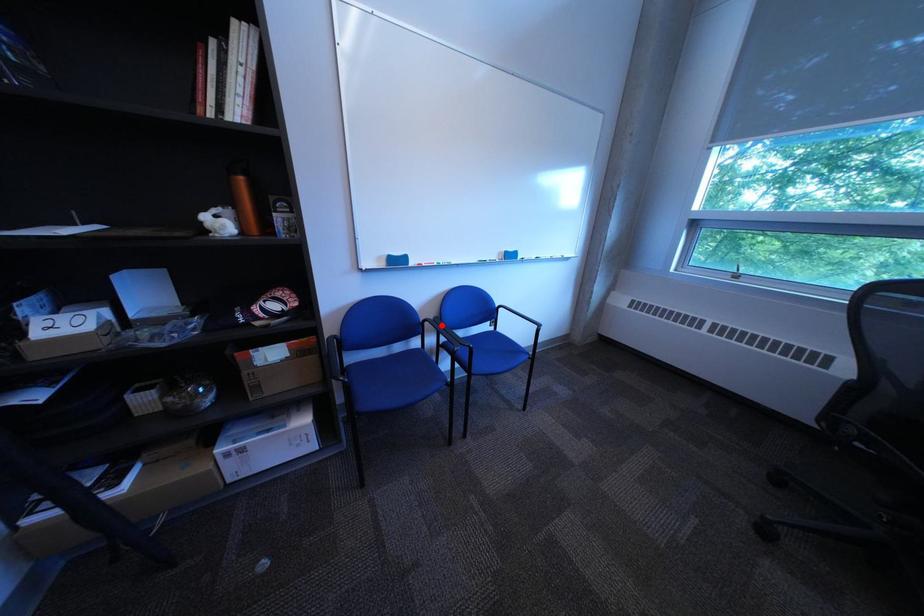
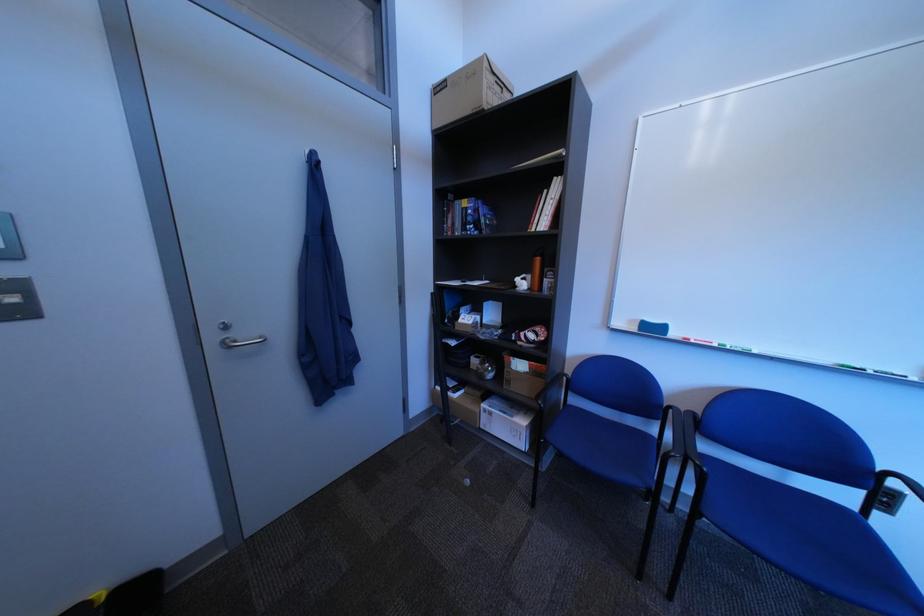
The point at the highlighted location is marked in the first image. Where is the corresponding point in the second image?

(687, 413)